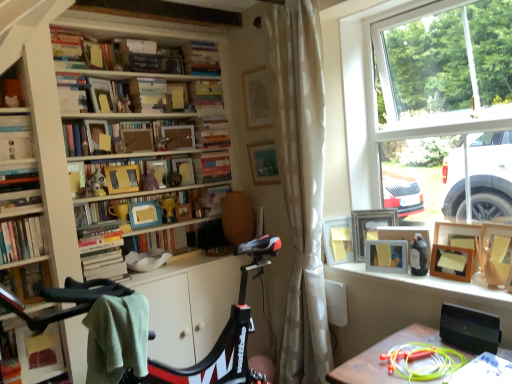
The height and width of the screenshot is (384, 512). What are the coordinates of `vacant point to the left of matte black bird at upper right, the third toy positioned from the top` in the screenshot? It's located at (387, 276).